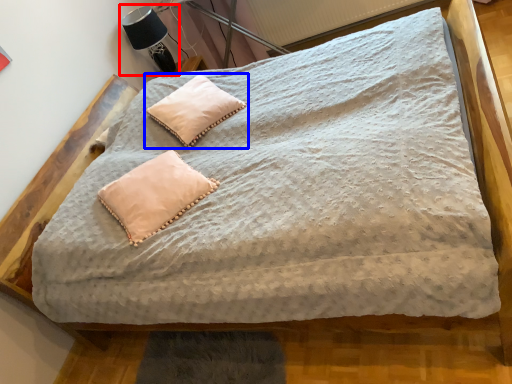
Question: Among these objects, which one is nearest to the camera, table lamp (highlighted by a red box) or pillow (highlighted by a blue box)?

Choices:
 (A) table lamp
 (B) pillow

Answer: (B)